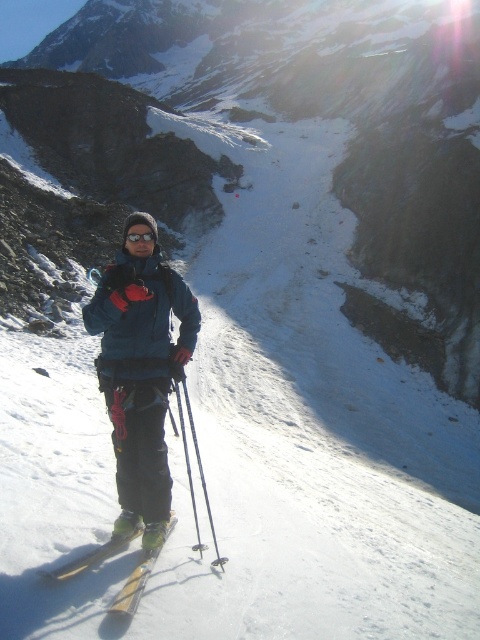
Is matte blue jacket at center shorter than metallic silver ski pole at center?

No, matte blue jacket at center is not shorter than metallic silver ski pole at center.

Which is behind, point (172, 275) or point (206, 509)?

Point (206, 509)

The image size is (480, 640). What do you see at coordinates (141, 369) in the screenshot?
I see `matte blue jacket at center` at bounding box center [141, 369].

Find the location of `matte blue jacket at center`. matte blue jacket at center is located at coordinates (141, 369).

From the picture: Between yellow metallic ski at lower center and metallic silver ski pole at center, which one is positioned higher?

Positioned higher is metallic silver ski pole at center.

Does yellow metallic ski at lower center appear over metallic silver ski pole at center?

Actually, yellow metallic ski at lower center is below metallic silver ski pole at center.

Between point (127, 588) and point (192, 429), which one is positioned behind?

The point (192, 429) is more distant.

Find the location of a particular element. The width and height of the screenshot is (480, 640). yellow metallic ski at lower center is located at coordinates (139, 577).

Is matte blue jacket at center smaller than yellow metallic ski at lower center?

Incorrect, matte blue jacket at center is not smaller in size than yellow metallic ski at lower center.

Does matte blue jacket at center appear on the right side of yellow metallic ski at lower center?

Incorrect, matte blue jacket at center is not on the right side of yellow metallic ski at lower center.

Locate an element on the screen. The width and height of the screenshot is (480, 640). matte blue jacket at center is located at coordinates (141, 369).